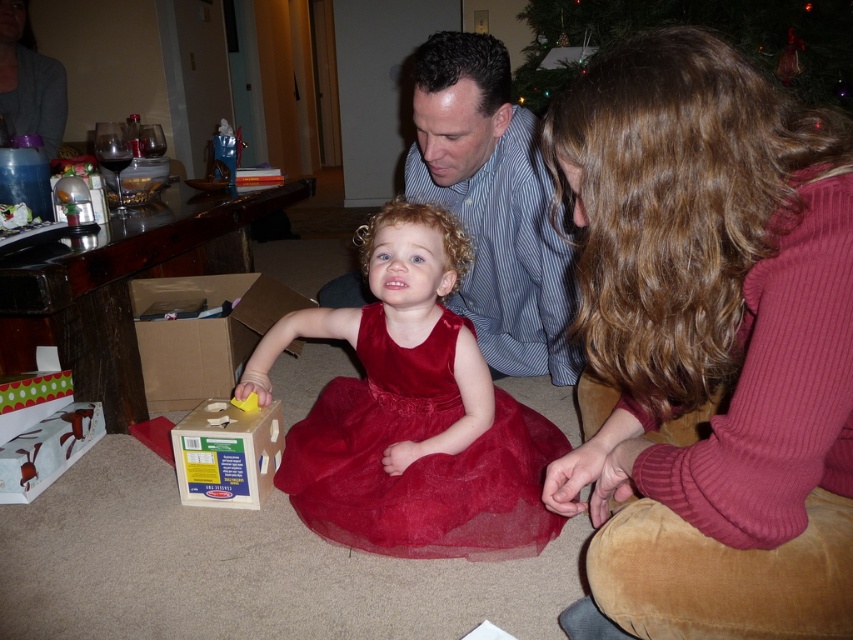
Question: Is blue striped shirt at center closer to the viewer compared to green glittering ornaments at upper center?

Choices:
 (A) yes
 (B) no

Answer: (A)

Question: Does blue striped shirt at center have a smaller size compared to matte white box at lower left?

Choices:
 (A) yes
 (B) no

Answer: (B)

Question: Among these objects, which one is farthest from the camera?

Choices:
 (A) gray knit sweater at upper left
 (B) velvet maroon sweater at lower right

Answer: (A)

Question: Is velvet maroon sweater at lower right further to camera compared to green glittering ornaments at upper center?

Choices:
 (A) yes
 (B) no

Answer: (B)

Question: Among these points, which one is nearest to the camera?

Choices:
 (A) (265, 449)
 (B) (1, 52)
 (C) (521, 99)

Answer: (A)

Question: Among these objects, which one is nearest to the camera?

Choices:
 (A) wooden box at center
 (B) cardboard box at lower left
 (C) gray knit sweater at upper left
 (D) satin tulle dress at center

Answer: (D)